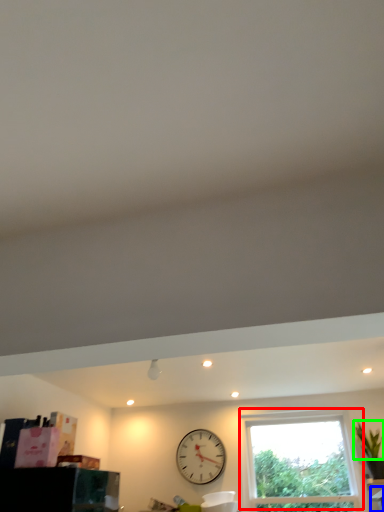
Question: Which object is positioned closest to window (highlighted by a red box)? Select from furniture (highlighted by a blue box) and plant (highlighted by a green box).

Choices:
 (A) furniture
 (B) plant

Answer: (B)